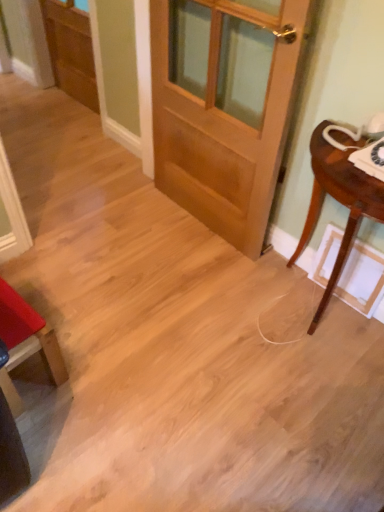
The image size is (384, 512). In order to click on free space to the left of light brown wood door at center in this screenshot , I will do `click(122, 226)`.